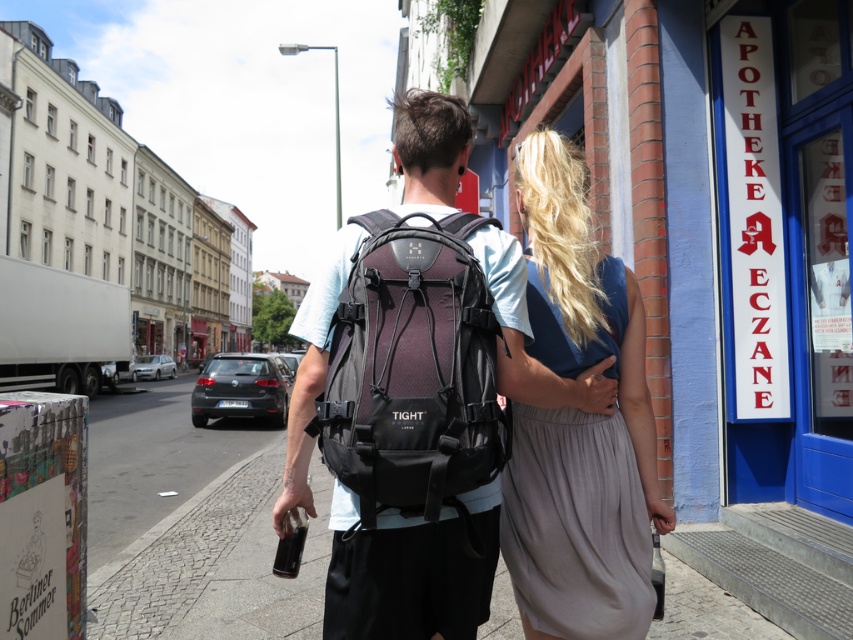
You are a fashion designer observing the light gray fabric dress at center and the matte black backpack at center in the image. Which item has a narrower width?

The light gray fabric dress at center is thinner than the matte black backpack at center, so the light gray fabric dress at center has a narrower width.

You are a delivery drone flying above the street scene. You need to land on the cobblestone pavement at center or the matte black backpack at center. According to the scene, which surface is shorter and therefore safer for landing?

The cobblestone pavement at center is shorter than the matte black backpack at center, so it is safer to land there.

You are standing on the sidewalk and want to take a photo of both people in the scene. Which person should you focus on first to ensure they are in focus, the one at point (323, 340) or the one at point (317, 472)?

You should focus on the person at point (323, 340) first because it is closer to the viewer than the person at point (317, 472).